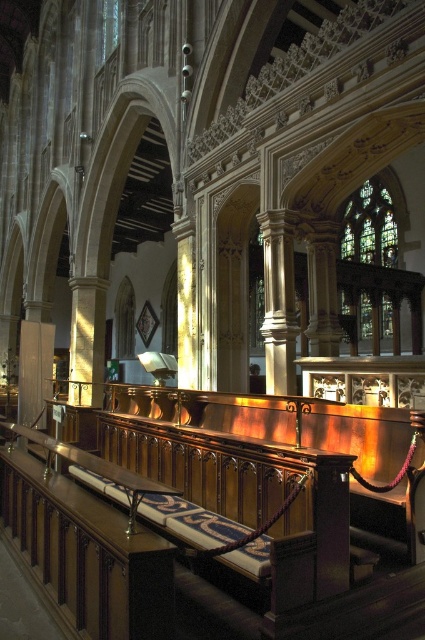
In the scene shown: You are an architect visiting the church and want to place a decorative vase between the polished wood church bench at center and the polished stone column at center. According to the scene, which side of the column should the vase be placed on?

The polished wood church bench at center is positioned on the left side of the polished stone column at center, so the vase should be placed on the left side of the column to be between them.